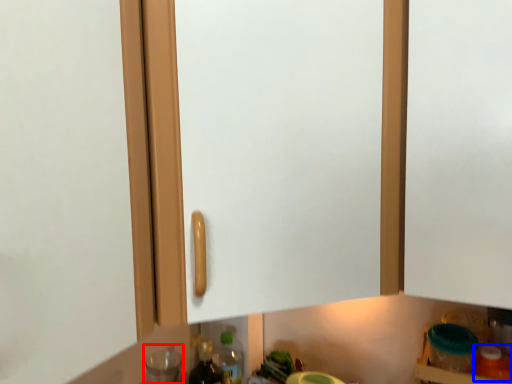
Question: Which point is closer to the camera, bottle (highlighted by a red box) or bottle (highlighted by a blue box)?

Choices:
 (A) bottle
 (B) bottle

Answer: (B)